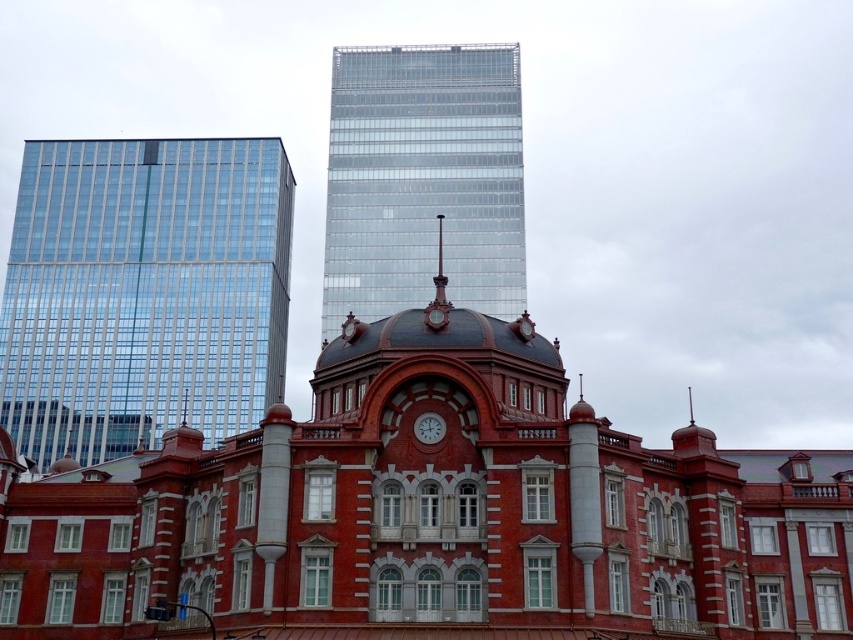
Question: Which point is farther from the camera taking this photo?

Choices:
 (A) (428, 412)
 (B) (125, 218)

Answer: (B)

Question: Which of the following is the farthest from the observer?

Choices:
 (A) (440, 438)
 (B) (180, 259)

Answer: (B)

Question: Does transparent glass skyscraper at upper center have a smaller size compared to matte red clock at center?

Choices:
 (A) no
 (B) yes

Answer: (A)

Question: Can you confirm if transparent glass skyscraper at upper left is positioned to the right of matte red clock at center?

Choices:
 (A) no
 (B) yes

Answer: (A)

Question: Can you confirm if transparent glass skyscraper at upper left is bigger than transparent glass skyscraper at upper center?

Choices:
 (A) yes
 (B) no

Answer: (A)

Question: Which point is farther to the camera?

Choices:
 (A) (428, 440)
 (B) (45, 336)
 (C) (372, 77)

Answer: (C)